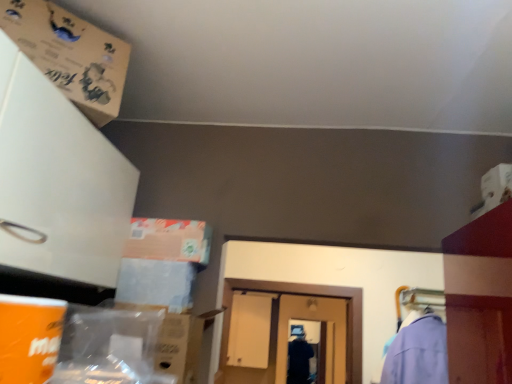
Question: From a real-world perspective, does brown cardboard box at upper left, which appears as the first cardboard box when viewed from the top, stand above matte cardboard box at lower left, which is the 2th cardboard box in top-to-bottom order?

Choices:
 (A) yes
 (B) no

Answer: (A)

Question: Does brown cardboard box at upper left, marked as the 2th cardboard box in a bottom-to-top arrangement, come in front of matte cardboard box at lower left, arranged as the first cardboard box when ordered from the bottom?

Choices:
 (A) yes
 (B) no

Answer: (A)

Question: Can you confirm if brown cardboard box at upper left, which appears as the first cardboard box when viewed from the top, is bigger than matte cardboard box at lower left, arranged as the first cardboard box when ordered from the bottom?

Choices:
 (A) yes
 (B) no

Answer: (B)

Question: Considering the relative sizes of brown cardboard box at upper left, marked as the 2th cardboard box in a bottom-to-top arrangement, and matte cardboard box at lower left, arranged as the first cardboard box when ordered from the bottom, in the image provided, is brown cardboard box at upper left, marked as the 2th cardboard box in a bottom-to-top arrangement, taller than matte cardboard box at lower left, arranged as the first cardboard box when ordered from the bottom,?

Choices:
 (A) no
 (B) yes

Answer: (A)

Question: Does brown cardboard box at upper left, which appears as the first cardboard box when viewed from the top, have a smaller size compared to matte cardboard box at lower left, arranged as the first cardboard box when ordered from the bottom?

Choices:
 (A) no
 (B) yes

Answer: (B)

Question: Is brown cardboard box at upper left, which appears as the first cardboard box when viewed from the top, aimed at matte cardboard box at lower left, arranged as the first cardboard box when ordered from the bottom?

Choices:
 (A) no
 (B) yes

Answer: (A)

Question: Is matte cardboard box at lower left, arranged as the first cardboard box when ordered from the bottom, further to the viewer compared to brown cardboard box at upper left, marked as the 2th cardboard box in a bottom-to-top arrangement?

Choices:
 (A) yes
 (B) no

Answer: (A)

Question: From the image's perspective, is matte cardboard box at lower left, which is the 2th cardboard box in top-to-bottom order, below brown cardboard box at upper left, marked as the 2th cardboard box in a bottom-to-top arrangement?

Choices:
 (A) no
 (B) yes

Answer: (B)

Question: Is matte cardboard box at lower left, which is the 2th cardboard box in top-to-bottom order, smaller than brown cardboard box at upper left, which appears as the first cardboard box when viewed from the top?

Choices:
 (A) no
 (B) yes

Answer: (A)

Question: From the image's perspective, would you say matte cardboard box at lower left, which is the 2th cardboard box in top-to-bottom order, is positioned over brown cardboard box at upper left, marked as the 2th cardboard box in a bottom-to-top arrangement?

Choices:
 (A) yes
 (B) no

Answer: (B)

Question: From a real-world perspective, is matte cardboard box at lower left, arranged as the first cardboard box when ordered from the bottom, positioned over brown cardboard box at upper left, marked as the 2th cardboard box in a bottom-to-top arrangement, based on gravity?

Choices:
 (A) no
 (B) yes

Answer: (A)

Question: Is matte cardboard box at lower left, arranged as the first cardboard box when ordered from the bottom, at the left side of brown cardboard box at upper left, which appears as the first cardboard box when viewed from the top?

Choices:
 (A) no
 (B) yes

Answer: (A)

Question: Based on their sizes in the image, would you say brown cardboard box at upper left, which appears as the first cardboard box when viewed from the top, is bigger or smaller than matte cardboard box at lower left, which is the 2th cardboard box in top-to-bottom order?

Choices:
 (A) small
 (B) big

Answer: (A)